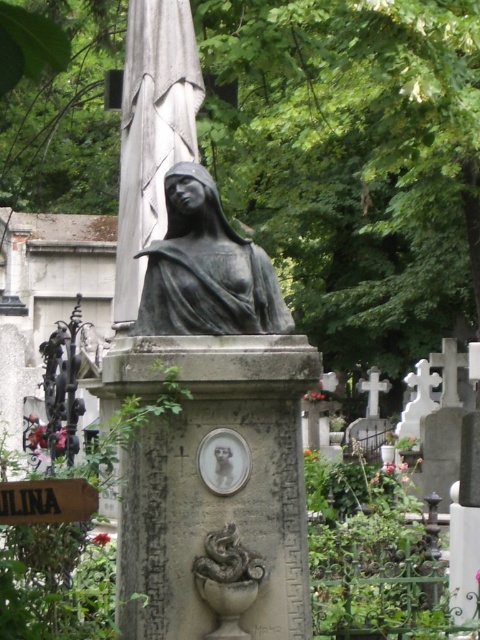
You are standing in a cemetery and see the bronze statue at center and the brown wood sign at lower left. Which object is higher in elevation?

The bronze statue at center is positioned over the brown wood sign at lower left, so it is higher in elevation.

You are a visitor at the cemetery and want to take a photo of the bronze statue at center and the brown wood sign at lower left together in the frame. Based on their positions, which object should you place closer to the camera to include both in the shot?

The bronze statue at center is positioned on the right side of brown wood sign at lower left. To include both in the shot, you should place the brown wood sign at lower left closer to the camera since it is further away from the bronze statue at center.